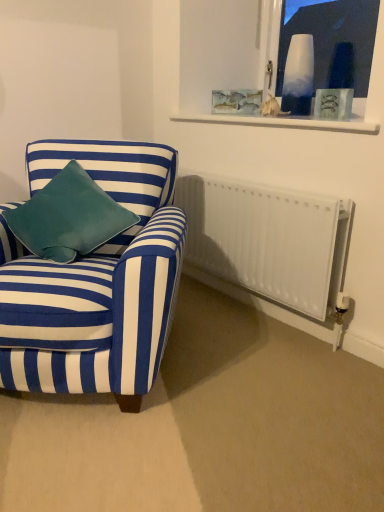
Question: Can you confirm if velvet teal pillow at left is smaller than clear glass frame at upper center?

Choices:
 (A) yes
 (B) no

Answer: (B)

Question: Can clear glass frame at upper center be found inside velvet teal pillow at left?

Choices:
 (A) no
 (B) yes

Answer: (A)

Question: Is velvet teal pillow at left aimed at clear glass frame at upper center?

Choices:
 (A) yes
 (B) no

Answer: (B)

Question: Would you say velvet teal pillow at left is a long distance from clear glass frame at upper center?

Choices:
 (A) yes
 (B) no

Answer: (A)

Question: From the image's perspective, is velvet teal pillow at left located above clear glass frame at upper center?

Choices:
 (A) no
 (B) yes

Answer: (A)

Question: Does velvet teal pillow at left come in front of clear glass frame at upper center?

Choices:
 (A) no
 (B) yes

Answer: (B)

Question: Can you confirm if velvet teal pillow at left is positioned to the left of white matte radiator at lower right?

Choices:
 (A) yes
 (B) no

Answer: (A)

Question: Is velvet teal pillow at left smaller than white matte radiator at lower right?

Choices:
 (A) yes
 (B) no

Answer: (B)

Question: Does velvet teal pillow at left have a greater width compared to white matte radiator at lower right?

Choices:
 (A) no
 (B) yes

Answer: (B)

Question: Is velvet teal pillow at left placed right next to white matte radiator at lower right?

Choices:
 (A) yes
 (B) no

Answer: (B)

Question: Is velvet teal pillow at left facing towards white matte radiator at lower right?

Choices:
 (A) yes
 (B) no

Answer: (B)

Question: Is velvet teal pillow at left in front of white matte radiator at lower right?

Choices:
 (A) yes
 (B) no

Answer: (A)

Question: Is clear glass frame at upper center not near velvet teal pillow at left?

Choices:
 (A) no
 (B) yes

Answer: (B)